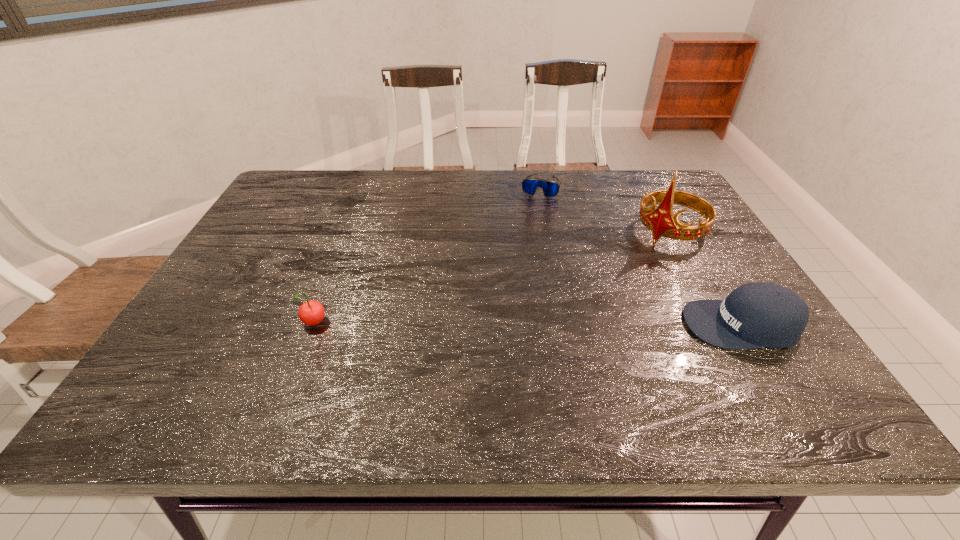
Where is `object present at the near right corner`? Image resolution: width=960 pixels, height=540 pixels. object present at the near right corner is located at coordinates (756, 315).

This screenshot has height=540, width=960. I want to click on vacant space at the far edge, so click(571, 192).

Locate an element on the screen. The height and width of the screenshot is (540, 960). free spot at the near edge of the desktop is located at coordinates (441, 368).

This screenshot has height=540, width=960. Identify the location of vacant area at the left edge. (259, 220).

Find the location of `vacant point at the right edge`. vacant point at the right edge is located at coordinates (682, 221).

The width and height of the screenshot is (960, 540). Identify the location of free space at the far left corner. (294, 204).

Identify the location of free region at the near left corner of the desktop. (208, 362).

In the image, there is a desktop. Identify the location of vacant area at the near right corner. (765, 372).

This screenshot has width=960, height=540. What are the coordinates of `free space between the third tallest object and the leftmost object` in the screenshot? It's located at (528, 325).

Where is `unoccupied area between the third nearest object and the cherry`? unoccupied area between the third nearest object and the cherry is located at coordinates (492, 279).